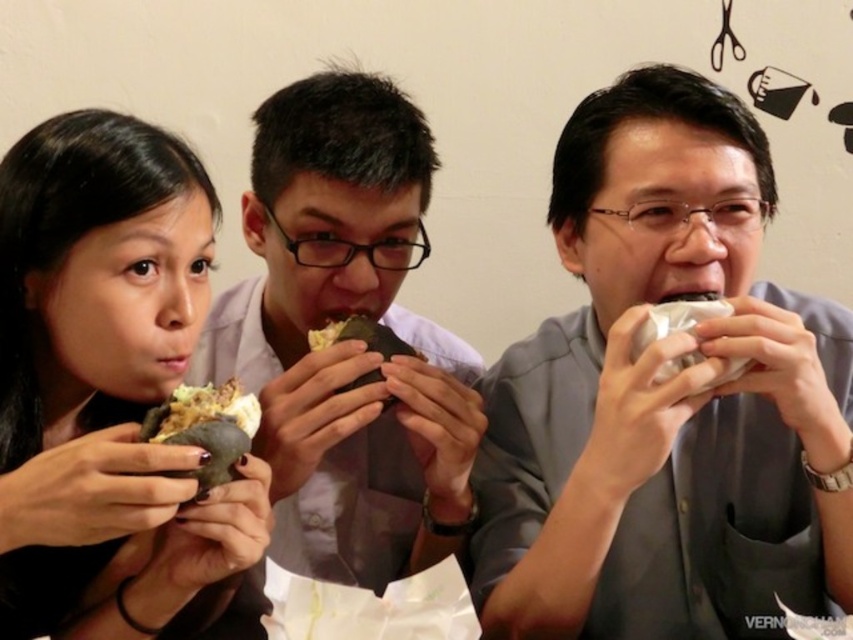
What is the location of the crumbly white bread at center in the image?

The crumbly white bread at center is located at point (206, 428).

Based on the photo, you are a photographer trying to capture the crumbly white bread at center in the image. Based on the coordinates provided, where should you position your camera focus to ensure the bread is sharp?

The crumbly white bread at center is located at point (206, 428), so you should position your camera focus at those coordinates to ensure the bread is sharp.